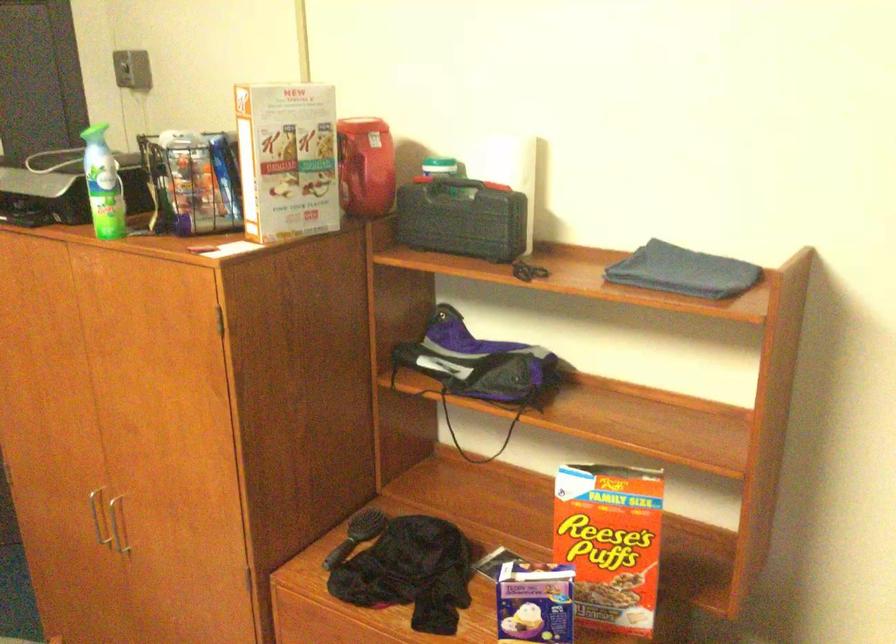
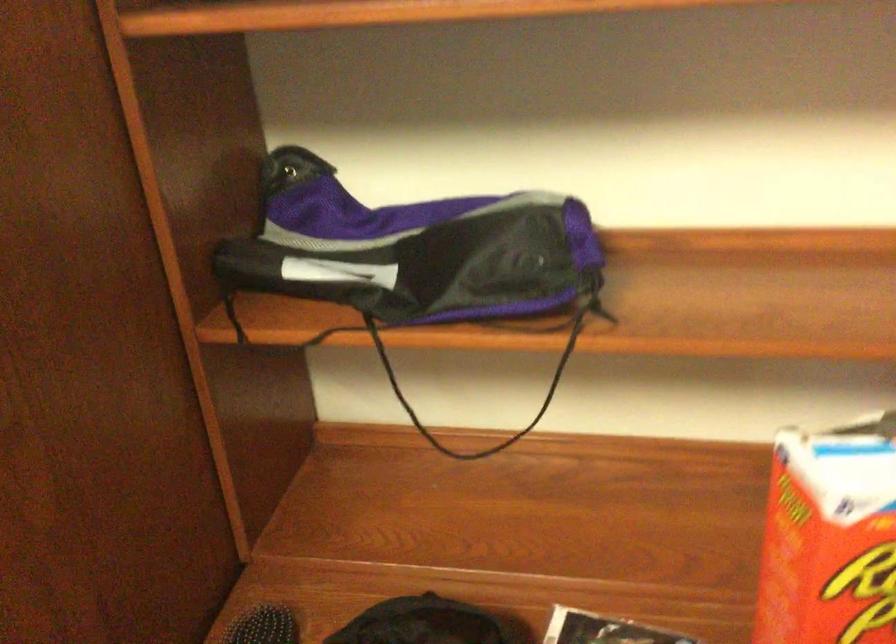
Locate, in the second image, the point that corresponds to [478,368] in the first image.

(415, 259)